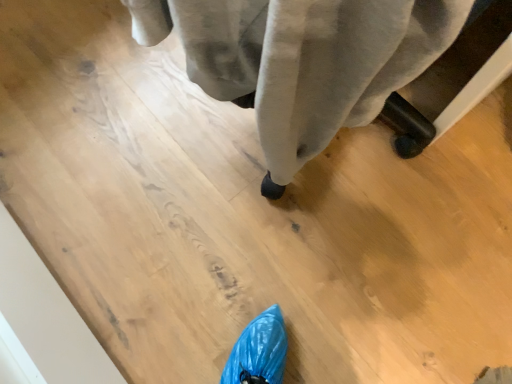
The image size is (512, 384). What do you see at coordinates (303, 60) in the screenshot?
I see `velvety gray blanket at upper center` at bounding box center [303, 60].

At what (x,y) coordinates should I click in order to perform the action: click on velvety gray blanket at upper center. Please return your answer as a coordinate pair (x, y). Looking at the image, I should click on (303, 60).

Locate an element on the screen. velvety gray blanket at upper center is located at coordinates (303, 60).